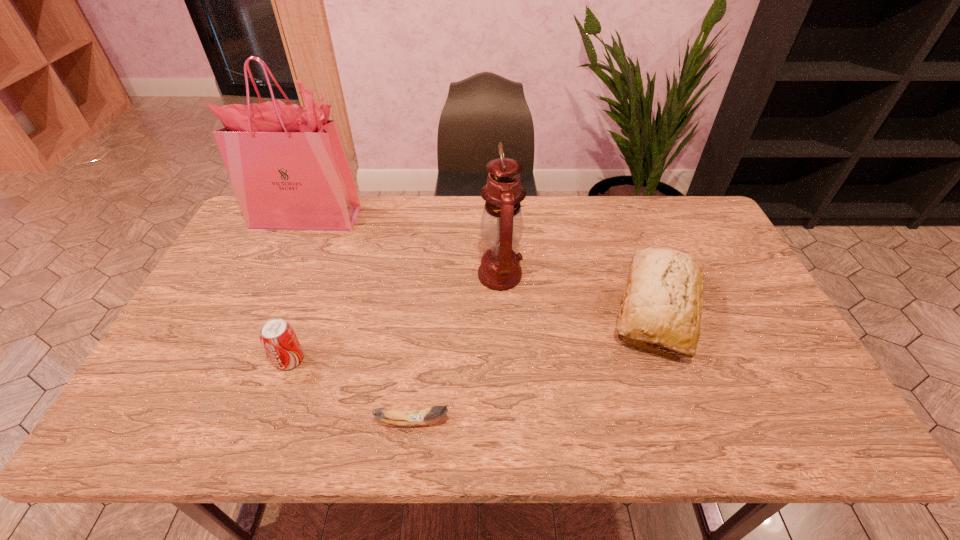
Find the location of a particular element. This screenshot has height=540, width=960. shopping bag is located at coordinates (287, 164).

You are a GUI agent. You are given a task and a screenshot of the screen. Output one action in this format:
    pyautogui.click(x=<x>, y=<y>)
    Task: Click on the farthest object
    
    Given the screenshot: What is the action you would take?
    pyautogui.click(x=287, y=164)

This screenshot has height=540, width=960. Find the location of `the second tallest object`. the second tallest object is located at coordinates (502, 224).

This screenshot has height=540, width=960. In order to click on the second object from right to left in this screenshot , I will do `click(502, 224)`.

I want to click on the rightmost object, so click(x=663, y=297).

The height and width of the screenshot is (540, 960). I want to click on soda, so click(277, 336).

Locate an element on the screen. The width and height of the screenshot is (960, 540). the shortest object is located at coordinates (418, 417).

Locate an element on the screen. This screenshot has width=960, height=540. the third object from left to right is located at coordinates (x=418, y=417).

Image resolution: width=960 pixels, height=540 pixels. I want to click on free space located 0.370m on the front of the tallest object, so click(x=263, y=317).

Find the location of a particular element. blank area located 0.150m on the left of the oil lamp is located at coordinates (428, 275).